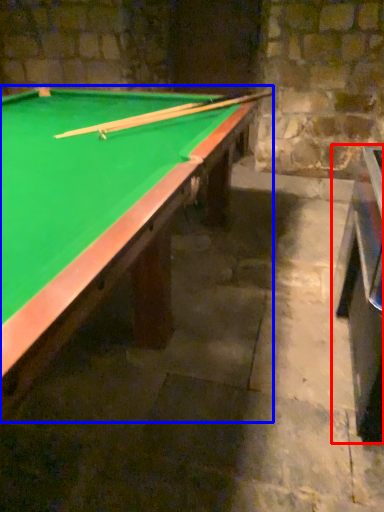
Question: Which object is closer to the camera taking this photo, table (highlighted by a red box) or billiard table (highlighted by a blue box)?

Choices:
 (A) table
 (B) billiard table

Answer: (B)